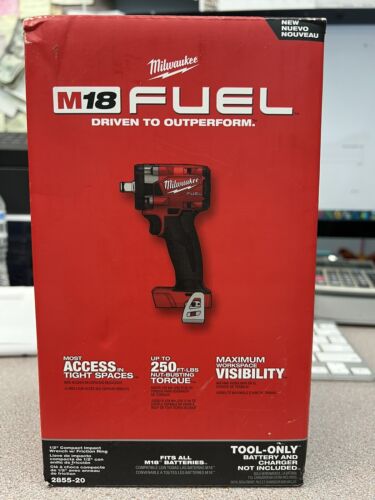
The image size is (375, 500). Find the location of `speckled grey counter`. speckled grey counter is located at coordinates (361, 445).